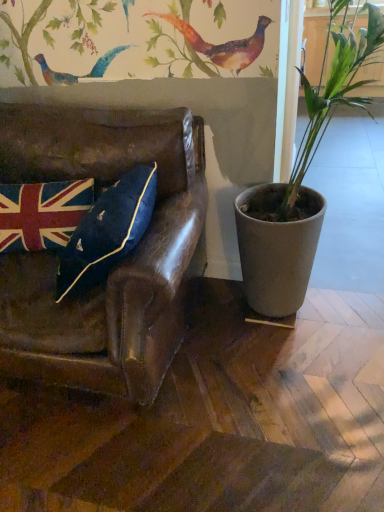
Question: Does leather couch at left appear on the left side of velvet union jack pillow at left?

Choices:
 (A) no
 (B) yes

Answer: (A)

Question: From the image's perspective, is leather couch at left over velvet union jack pillow at left?

Choices:
 (A) no
 (B) yes

Answer: (A)

Question: Is leather couch at left looking in the opposite direction of velvet union jack pillow at left?

Choices:
 (A) yes
 (B) no

Answer: (A)

Question: Considering the relative positions of leather couch at left and velvet union jack pillow at left in the image provided, is leather couch at left in front of velvet union jack pillow at left?

Choices:
 (A) yes
 (B) no

Answer: (A)

Question: Is leather couch at left completely or partially outside of velvet union jack pillow at left?

Choices:
 (A) no
 (B) yes

Answer: (B)

Question: From a real-world perspective, is leather couch at left positioned above or below matte gray pot at right?

Choices:
 (A) below
 (B) above

Answer: (A)

Question: Would you say leather couch at left is inside or outside matte gray pot at right?

Choices:
 (A) inside
 (B) outside

Answer: (B)

Question: Is leather couch at left taller or shorter than matte gray pot at right?

Choices:
 (A) short
 (B) tall

Answer: (A)

Question: Considering the positions of leather couch at left and matte gray pot at right in the image, is leather couch at left wider or thinner than matte gray pot at right?

Choices:
 (A) thin
 (B) wide

Answer: (A)

Question: Based on their positions, is velvet union jack pillow at left located to the left or right of matte gray pot at right?

Choices:
 (A) left
 (B) right

Answer: (A)

Question: From a real-world perspective, is velvet union jack pillow at left positioned above or below matte gray pot at right?

Choices:
 (A) above
 (B) below

Answer: (B)

Question: From the image's perspective, is velvet union jack pillow at left located above or below matte gray pot at right?

Choices:
 (A) above
 (B) below

Answer: (B)

Question: In terms of width, does velvet union jack pillow at left look wider or thinner when compared to matte gray pot at right?

Choices:
 (A) wide
 (B) thin

Answer: (B)

Question: Is matte gray pot at right situated inside leather couch at left or outside?

Choices:
 (A) inside
 (B) outside

Answer: (B)

Question: Does point (307, 222) appear closer or farther from the camera than point (122, 306)?

Choices:
 (A) farther
 (B) closer

Answer: (A)